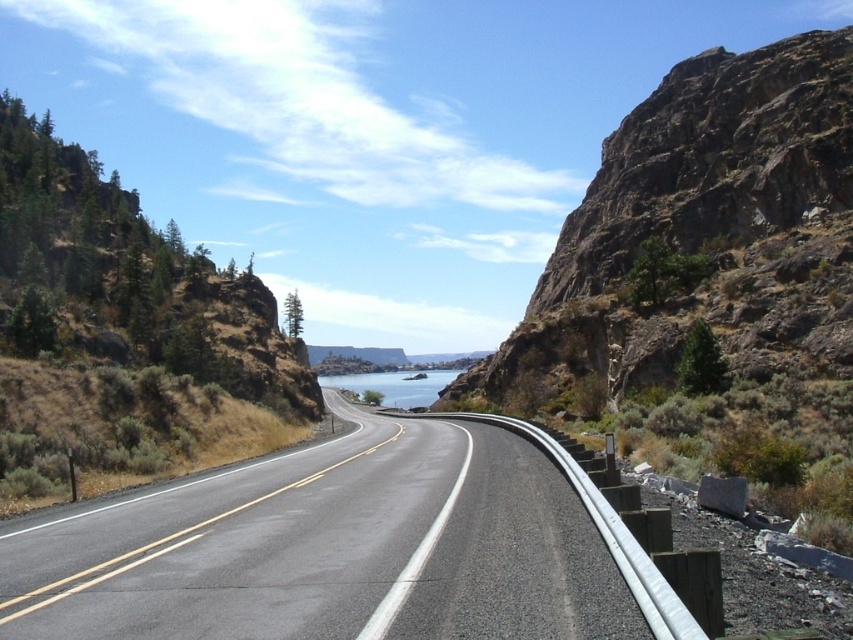
Question: Is black asphalt highway at center below green textured rock at left?

Choices:
 (A) yes
 (B) no

Answer: (A)

Question: Which of these objects is positioned closest to the black asphalt highway at center?

Choices:
 (A) clear blue water at center
 (B) green textured rock at left

Answer: (B)

Question: Which object is positioned farthest from the green textured rock at left?

Choices:
 (A) clear blue water at center
 (B) black asphalt highway at center

Answer: (A)

Question: Which is farther from the green textured rock at left?

Choices:
 (A) clear blue water at center
 (B) black asphalt highway at center

Answer: (A)

Question: Is black asphalt highway at center above green textured rock at left?

Choices:
 (A) yes
 (B) no

Answer: (B)

Question: Considering the relative positions of black asphalt highway at center and green textured rock at left in the image provided, where is black asphalt highway at center located with respect to green textured rock at left?

Choices:
 (A) right
 (B) left

Answer: (A)